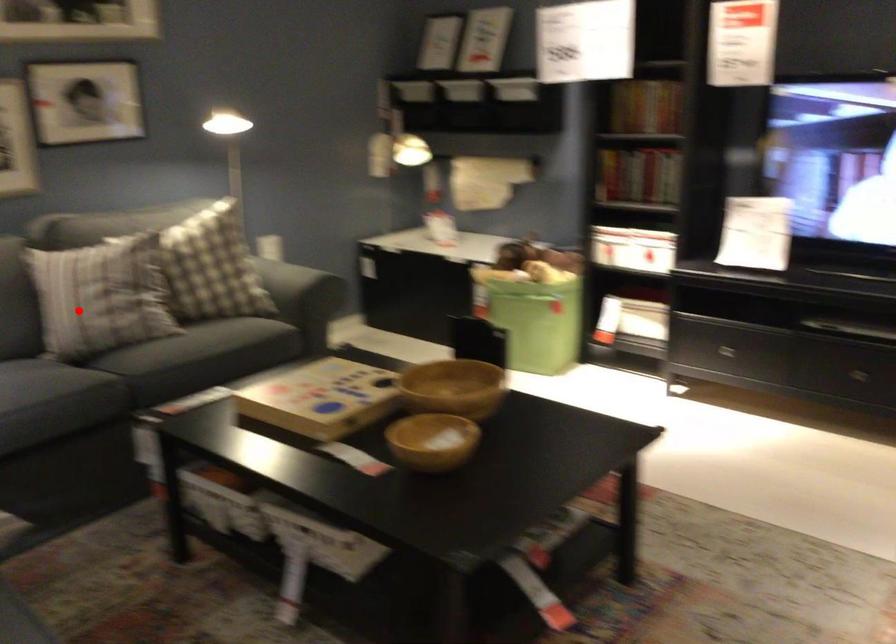
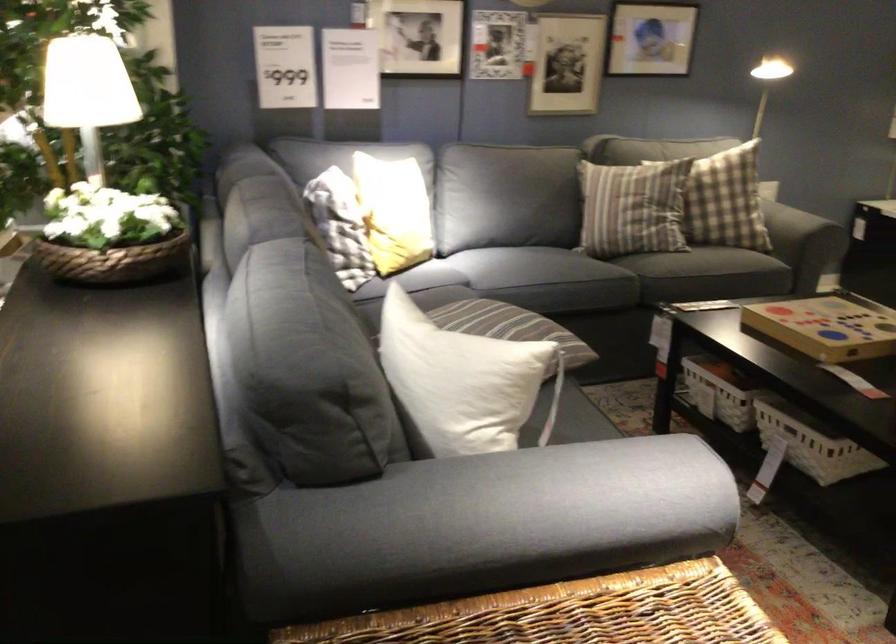
Locate, in the second image, the point that corresponds to the highlighted location in the first image.

(633, 207)